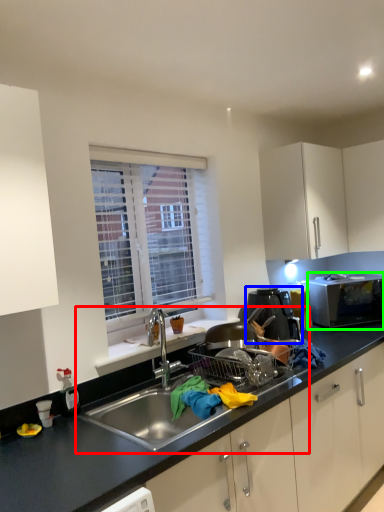
Question: Which is farther away from sink (highlighted by a red box)? home appliance (highlighted by a blue box) or microwave oven (highlighted by a green box)?

Choices:
 (A) home appliance
 (B) microwave oven

Answer: (B)